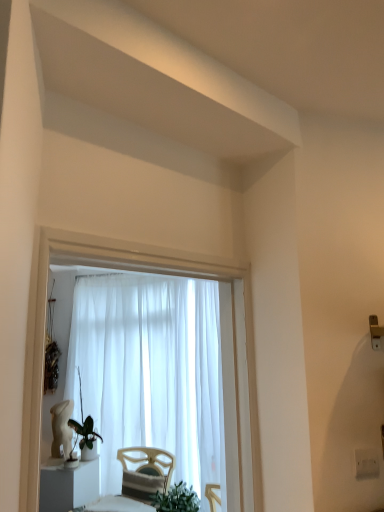
Consider the image. Measure the distance between point (96, 448) and camera.

11.07 feet.

This screenshot has width=384, height=512. What do you see at coordinates (366, 463) in the screenshot?
I see `white plastic electric outlet at lower right` at bounding box center [366, 463].

What do you see at coordinates (150, 372) in the screenshot?
I see `white sheer curtain at center` at bounding box center [150, 372].

This screenshot has width=384, height=512. In order to click on white sheer curtain at center in this screenshot , I will do `click(150, 372)`.

You are a GUI agent. You are given a task and a screenshot of the screen. Output one action in this format:
    pyautogui.click(x=<x>, y=<y>)
    Task: Click on the green matte plant at lower left
    
    Given the screenshot: What is the action you would take?
    pyautogui.click(x=86, y=437)

Is white sheer curtain at center looking in the opposite direction of green matte plant at lower left?

No, white sheer curtain at center is not facing away from green matte plant at lower left.

In the scene shown: Is white sheer curtain at center placed right next to green matte plant at lower left?

white sheer curtain at center and green matte plant at lower left are not in contact.

Considering the relative sizes of white sheer curtain at center and green matte plant at lower left in the image provided, is white sheer curtain at center shorter than green matte plant at lower left?

In fact, white sheer curtain at center may be taller than green matte plant at lower left.

The height and width of the screenshot is (512, 384). Find the location of `electric outlet in front of the white sheer curtain at center`. electric outlet in front of the white sheer curtain at center is located at coordinates (366, 463).

From a real-world perspective, relative to white plastic electric outlet at lower right, is white sheer curtain at center vertically above or below?

white sheer curtain at center is above white plastic electric outlet at lower right.

Between white sheer curtain at center and white plastic electric outlet at lower right, which one appears on the left side from the viewer's perspective?

From the viewer's perspective, white sheer curtain at center appears more on the left side.

Can you confirm if white glossy statue at lower left is positioned to the left of white plastic electric outlet at lower right?

Yes.

Looking at this image, from the image's perspective, which one is positioned lower, white glossy statue at lower left or white plastic electric outlet at lower right?

white glossy statue at lower left, from the image's perspective.

Considering the points (63, 483) and (368, 465), which point is behind, point (63, 483) or point (368, 465)?

Point (63, 483)

Is white glossy statue at lower left located outside white plastic electric outlet at lower right?

Yes, white glossy statue at lower left is not within white plastic electric outlet at lower right.

From the image's perspective, is green matte plant at lower left on white sheer curtain at center?

Incorrect, from the image's perspective, green matte plant at lower left is lower than white sheer curtain at center.

Does green matte plant at lower left turn towards white sheer curtain at center?

No, green matte plant at lower left is not facing towards white sheer curtain at center.

Consider the image. Is the surface of green matte plant at lower left in direct contact with white sheer curtain at center?

green matte plant at lower left and white sheer curtain at center are not in contact.

Can you confirm if green matte plant at lower left is bigger than white sheer curtain at center?

No, green matte plant at lower left is not bigger than white sheer curtain at center.

Where is `electric outlet in front of the green matte plant at lower left`? electric outlet in front of the green matte plant at lower left is located at coordinates (366, 463).

Based on the photo, considering the sizes of objects white plastic electric outlet at lower right and green matte plant at lower left in the image provided, who is shorter, white plastic electric outlet at lower right or green matte plant at lower left?

white plastic electric outlet at lower right.

Is white plastic electric outlet at lower right outside of green matte plant at lower left?

That's correct, white plastic electric outlet at lower right is outside of green matte plant at lower left.

From a real-world perspective, is white plastic electric outlet at lower right beneath green matte plant at lower left?

Actually, white plastic electric outlet at lower right is physically above green matte plant at lower left in the real world.

Is white glossy statue at lower left at the back of white plastic electric outlet at lower right?

white plastic electric outlet at lower right is not turned away from white glossy statue at lower left.

Can you confirm if white plastic electric outlet at lower right is wider than white glossy statue at lower left?

Incorrect, the width of white plastic electric outlet at lower right does not surpass that of white glossy statue at lower left.

Locate an element on the screen. Image resolution: width=384 pixels, height=512 pixels. electric outlet that is on the right side of white glossy statue at lower left is located at coordinates (366, 463).

Is white plastic electric outlet at lower right surrounding white glossy statue at lower left?

No, white glossy statue at lower left is not a part of white plastic electric outlet at lower right.

Does white plastic electric outlet at lower right turn towards white sheer curtain at center?

No.

How far apart are white plastic electric outlet at lower right and white sheer curtain at center?

white plastic electric outlet at lower right is 7.77 feet from white sheer curtain at center.

I want to click on electric outlet below the white sheer curtain at center (from a real-world perspective), so click(x=366, y=463).

Locate an element on the screen. This screenshot has height=512, width=384. curtain lying behind the green matte plant at lower left is located at coordinates (150, 372).

This screenshot has height=512, width=384. Find the location of `electric outlet below the white sheer curtain at center (from a real-world perspective)`. electric outlet below the white sheer curtain at center (from a real-world perspective) is located at coordinates (366, 463).

Which object lies nearer to the anchor point green matte plant at lower left, white plastic electric outlet at lower right or white glossy statue at lower left?

white glossy statue at lower left is positioned closer to the anchor green matte plant at lower left.

From the picture: Looking at the image, which one is located closer to white plastic electric outlet at lower right, white sheer curtain at center or white glossy statue at lower left?

Based on the image, white sheer curtain at center appears to be nearer to white plastic electric outlet at lower right.

Which object lies further to the anchor point white glossy statue at lower left, white sheer curtain at center or green matte plant at lower left?

white sheer curtain at center is positioned further to the anchor white glossy statue at lower left.

From the image, which object appears to be farther from white plastic electric outlet at lower right, green matte plant at lower left or white sheer curtain at center?

green matte plant at lower left lies further to white plastic electric outlet at lower right than the other object.

Consider the image. From the image, which object appears to be farther from white sheer curtain at center, white plastic electric outlet at lower right or green matte plant at lower left?

white plastic electric outlet at lower right is positioned further to the anchor white sheer curtain at center.

From the image, which object appears to be nearer to green matte plant at lower left, white glossy statue at lower left or white plastic electric outlet at lower right?

The object closer to green matte plant at lower left is white glossy statue at lower left.

Considering their positions, is white sheer curtain at center positioned further to green matte plant at lower left than white glossy statue at lower left?

white sheer curtain at center is further to green matte plant at lower left.

Estimate the real-world distances between objects in this image. Which object is closer to green matte plant at lower left, white sheer curtain at center or white plastic electric outlet at lower right?

Among the two, white sheer curtain at center is located nearer to green matte plant at lower left.

At what (x,y) coordinates should I click in order to perform the action: click on furniture between white plastic electric outlet at lower right and green matte plant at lower left in the front-back direction. Please return your answer as a coordinate pair (x, y). The image size is (384, 512). Looking at the image, I should click on (68, 485).

Find the location of `houseplant between white sheer curtain at center and white glossy statue at lower left in the vertical direction`. houseplant between white sheer curtain at center and white glossy statue at lower left in the vertical direction is located at coordinates (86, 437).

Where is `furniture located between white plastic electric outlet at lower right and white sheer curtain at center in the depth direction`? This screenshot has width=384, height=512. furniture located between white plastic electric outlet at lower right and white sheer curtain at center in the depth direction is located at coordinates (68, 485).

The width and height of the screenshot is (384, 512). I want to click on houseplant between white plastic electric outlet at lower right and white sheer curtain at center from front to back, so click(x=86, y=437).